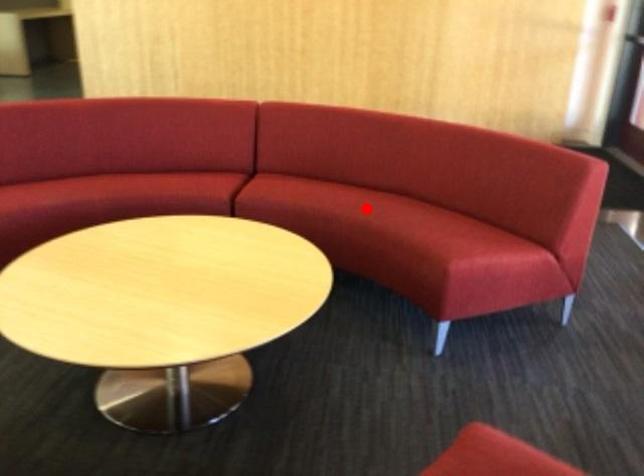
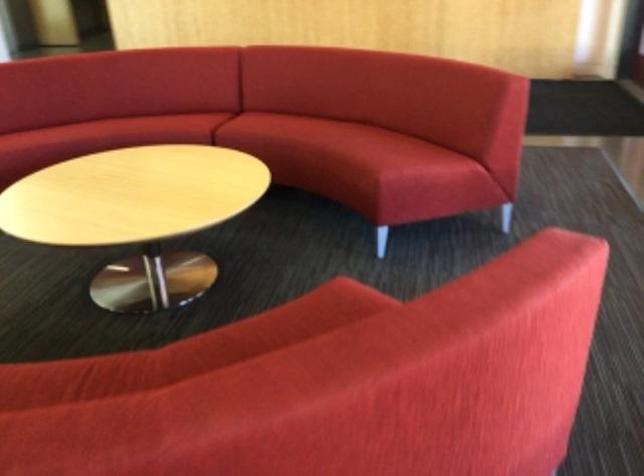
Locate, in the second image, the point that corresponds to the highlighted location in the first image.

(326, 134)